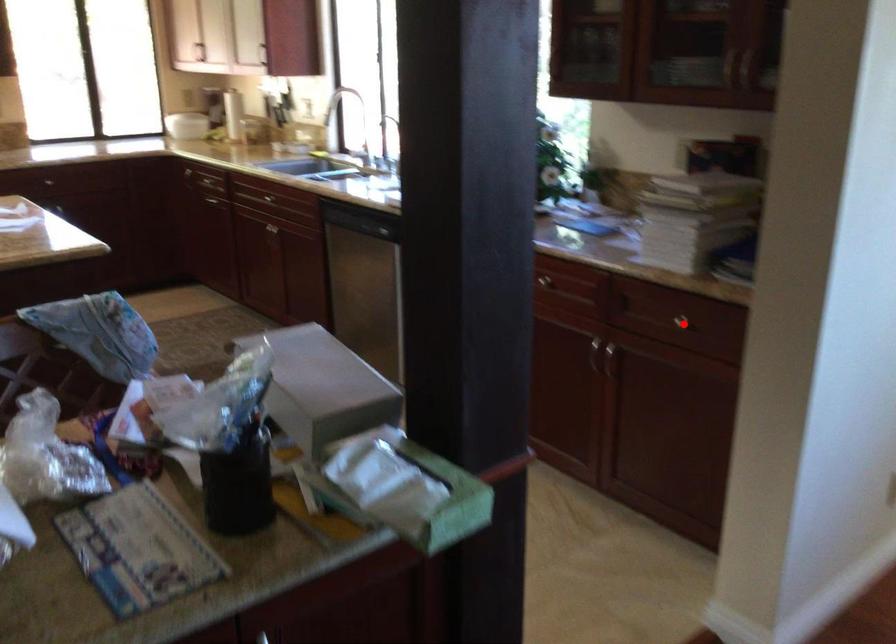
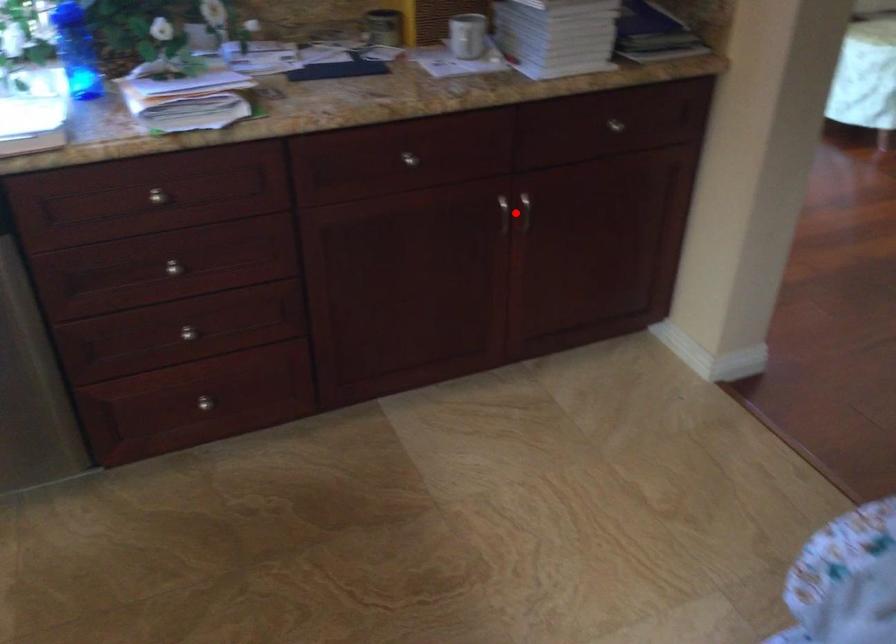
I am providing you with two images of the same scene from different viewpoints. A red point is marked on the first image and another point is marked on the second image. Is the marked point in image1 the same physical position as the marked point in image2?

No